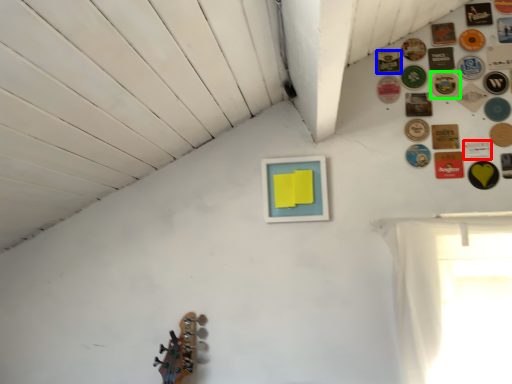
Question: Which object is the closest to the button (highlighted by a red box)? Choose among these: button (highlighted by a blue box) or button (highlighted by a green box).

Choices:
 (A) button
 (B) button

Answer: (B)